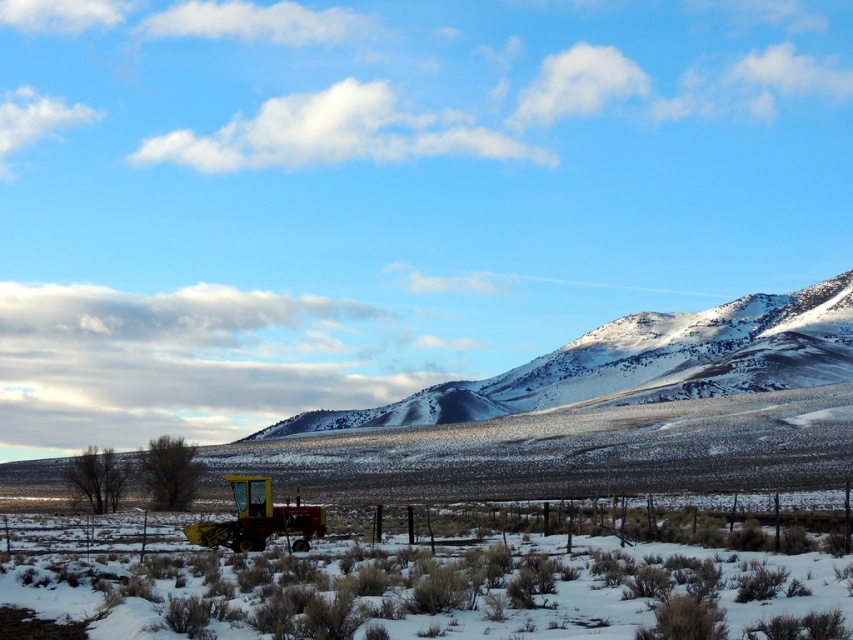
Question: Which object is closer to the camera taking this photo?

Choices:
 (A) snowy rocky mountain at center
 (B) red matte tractor at lower left

Answer: (B)

Question: Which of the following is the closest to the observer?

Choices:
 (A) red matte tractor at lower left
 (B) snowy rocky mountain at center

Answer: (A)

Question: Can you confirm if snowy rocky mountain at center is thinner than red matte tractor at lower left?

Choices:
 (A) yes
 (B) no

Answer: (B)

Question: Is snowy rocky mountain at center closer to the viewer compared to red matte tractor at lower left?

Choices:
 (A) no
 (B) yes

Answer: (A)

Question: Among these objects, which one is nearest to the camera?

Choices:
 (A) snowy rocky mountain at center
 (B) red matte tractor at lower left

Answer: (B)

Question: Is snowy rocky mountain at center to the left of red matte tractor at lower left from the viewer's perspective?

Choices:
 (A) yes
 (B) no

Answer: (B)